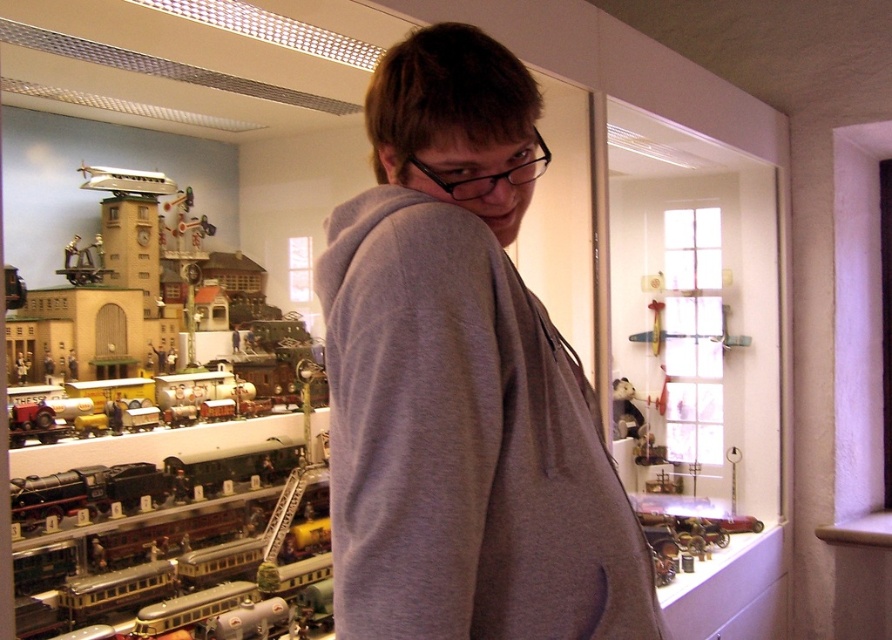
You are a photographer trying to capture a clear shot of the display case without any obstructions. The gray cotton hoodie at center is currently blocking your view. Based on its position, can you estimate whether moving your camera slightly to the left or right would allow you to frame the display case better?

The gray cotton hoodie at center is positioned at coordinates approximately 0.595 on the x and 0.520 on the y axis. Since it is centered, moving the camera slightly to either the left or right could help avoid the obstruction, but the exact direction depends on the display case location relative to the hoodie. However, since the hoodie is at the center, shifting the camera to either side might provide a clearer view of the display case.